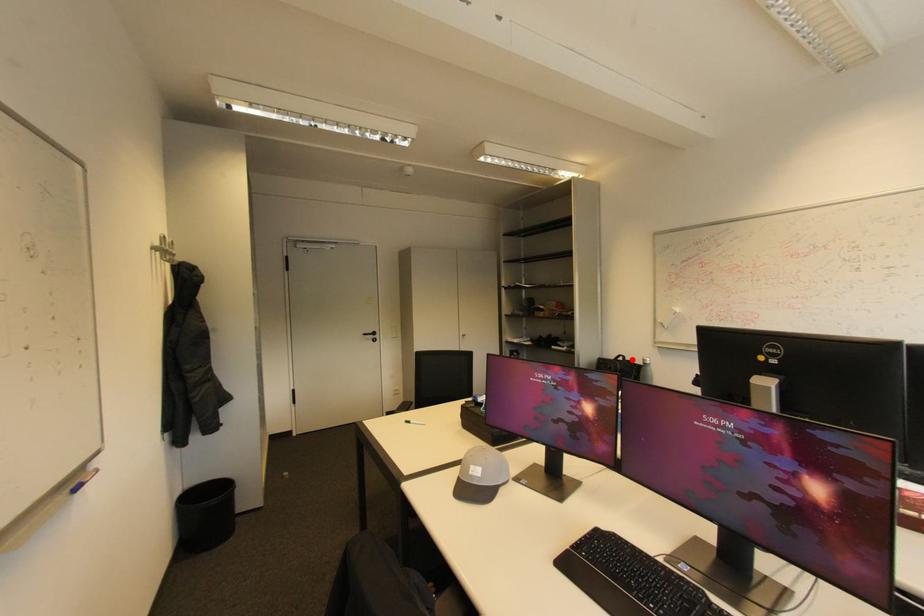
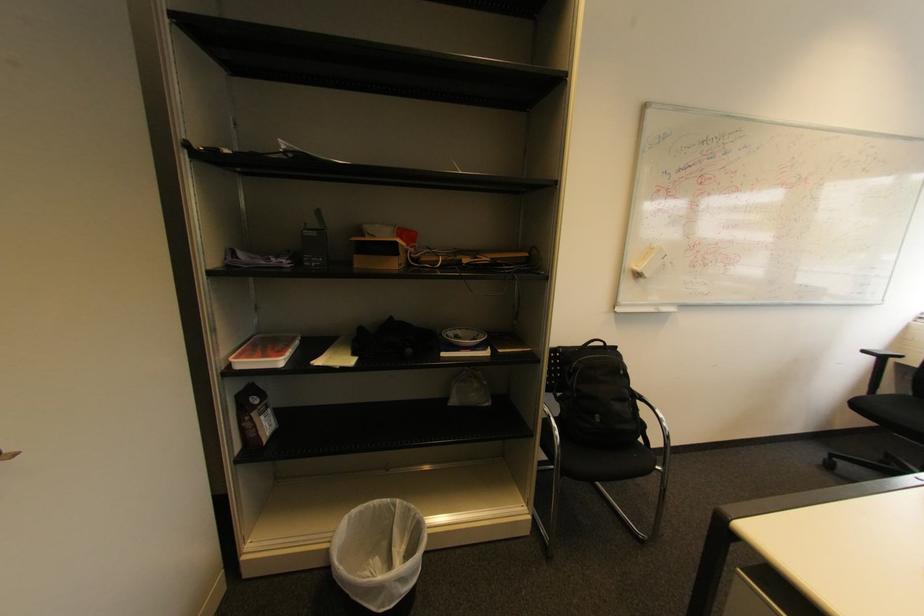
The point at the highlighted location is marked in the first image. Where is the corresponding point in the second image?

(613, 345)